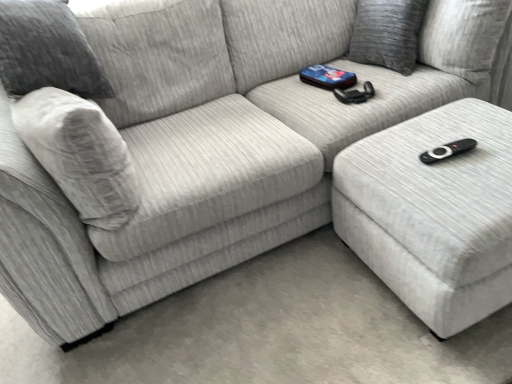
Where is `vacant space situated above white fabric ottoman at lower right (from a real-world perspective)`? This screenshot has height=384, width=512. vacant space situated above white fabric ottoman at lower right (from a real-world perspective) is located at coordinates (449, 149).